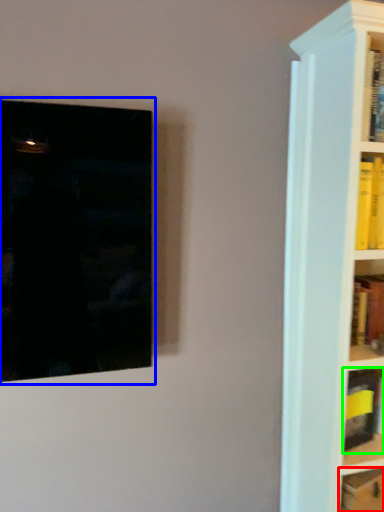
Question: Which is nearer to the book (highlighted by a red box)? picture frame (highlighted by a blue box) or book (highlighted by a green box).

Choices:
 (A) picture frame
 (B) book

Answer: (B)